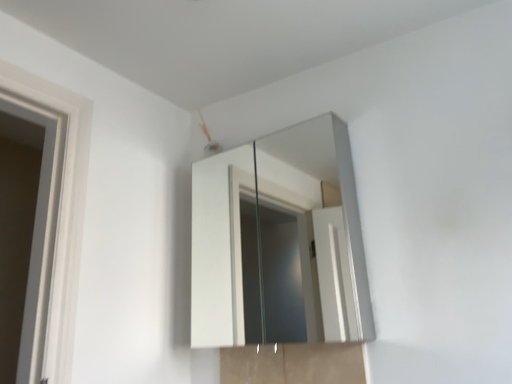
The image size is (512, 384). What do you see at coordinates (279, 242) in the screenshot?
I see `white glossy medicine cabinet at upper center` at bounding box center [279, 242].

Where is `white glossy medicine cabinet at upper center`? white glossy medicine cabinet at upper center is located at coordinates (279, 242).

Find the location of a particular element. The height and width of the screenshot is (384, 512). white glossy medicine cabinet at upper center is located at coordinates (279, 242).